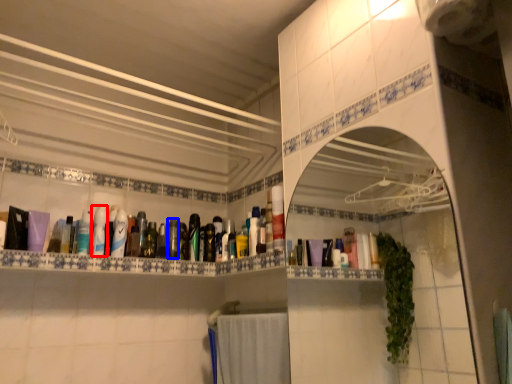
Question: Which object appears closest to the camera in this image, mouthwash (highlighted by a red box) or mouthwash (highlighted by a blue box)?

Choices:
 (A) mouthwash
 (B) mouthwash

Answer: (A)